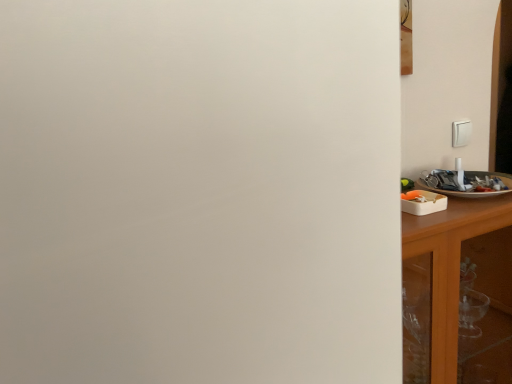
Measure the distance between point (452, 381) and camera.

They are 1.08 meters apart.

Measure the distance between wooden cabinet at right and camera.

The depth of wooden cabinet at right is 36.33 inches.

Describe the element at coordinates (450, 265) in the screenshot. This screenshot has height=384, width=512. I see `wooden cabinet at right` at that location.

At what (x,y) coordinates should I click in order to perform the action: click on wooden cabinet at right. Please return your answer as a coordinate pair (x, y). Looking at the image, I should click on (450, 265).

Locate an element on the screen. The height and width of the screenshot is (384, 512). white glossy plate at right is located at coordinates (469, 191).

This screenshot has height=384, width=512. What do you see at coordinates (469, 191) in the screenshot? I see `white glossy plate at right` at bounding box center [469, 191].

Image resolution: width=512 pixels, height=384 pixels. In order to click on wooden cabinet at right in this screenshot , I will do `click(450, 265)`.

Considering the positions of objects white glossy plate at right and wooden cabinet at right in the image provided, who is more to the right, white glossy plate at right or wooden cabinet at right?

white glossy plate at right is more to the right.

Is white glossy plate at right positioned before wooden cabinet at right?

No.

Which point is more forward, (474, 194) or (454, 350)?

The point (454, 350) is closer to the camera.

From the image's perspective, between white glossy plate at right and wooden cabinet at right, which one is located above?

white glossy plate at right is shown above in the image.

From a real-world perspective, which is physically below, white glossy plate at right or wooden cabinet at right?

In real-world perspective, wooden cabinet at right is lower.

From the picture: Does white glossy plate at right have a lesser width compared to wooden cabinet at right?

Correct, the width of white glossy plate at right is less than that of wooden cabinet at right.

Does white glossy plate at right have a greater height compared to wooden cabinet at right?

No.

Does white glossy plate at right have a larger size compared to wooden cabinet at right?

No, white glossy plate at right is not bigger than wooden cabinet at right.

Is white glossy plate at right completely or partially outside of wooden cabinet at right?

Yes, white glossy plate at right is outside of wooden cabinet at right.

Does white glossy plate at right touch wooden cabinet at right?

white glossy plate at right and wooden cabinet at right are not in contact.

Could you tell me if white glossy plate at right is turned towards wooden cabinet at right?

No, white glossy plate at right is not turned towards wooden cabinet at right.

How different are the orientations of white glossy plate at right and wooden cabinet at right in degrees?

The angle between the facing direction of white glossy plate at right and the facing direction of wooden cabinet at right is 0.000323 degrees.

How much distance is there between white glossy plate at right and wooden cabinet at right?

white glossy plate at right and wooden cabinet at right are 7.18 inches apart from each other.

Where is `cabinetry that is under the white glossy plate at right (from a real-world perspective)`? cabinetry that is under the white glossy plate at right (from a real-world perspective) is located at coordinates [x=450, y=265].

Between wooden cabinet at right and white glossy plate at right, which one appears on the right side from the viewer's perspective?

From the viewer's perspective, white glossy plate at right appears more on the right side.

Considering the positions of objects wooden cabinet at right and white glossy plate at right in the image provided, who is in front, wooden cabinet at right or white glossy plate at right?

Positioned in front is wooden cabinet at right.

Which is behind, point (439, 219) or point (506, 176)?

The point (506, 176) is behind.

From the image's perspective, is wooden cabinet at right positioned above or below white glossy plate at right?

Clearly, from the image's perspective, wooden cabinet at right is below white glossy plate at right.

From a real-world perspective, who is located lower, wooden cabinet at right or white glossy plate at right?

wooden cabinet at right is physically lower.

Which object is wider, wooden cabinet at right or white glossy plate at right?

With larger width is wooden cabinet at right.

Which of these two, wooden cabinet at right or white glossy plate at right, stands shorter?

white glossy plate at right.

Which of these two, wooden cabinet at right or white glossy plate at right, is smaller?

With smaller size is white glossy plate at right.

Is wooden cabinet at right spatially inside white glossy plate at right, or outside of it?

wooden cabinet at right is spatially situated outside white glossy plate at right.

Is wooden cabinet at right placed right next to white glossy plate at right?

No, wooden cabinet at right is not in contact with white glossy plate at right.

Is wooden cabinet at right aimed at white glossy plate at right?

No, wooden cabinet at right is not facing towards white glossy plate at right.

Can you tell me how much wooden cabinet at right and white glossy plate at right differ in facing direction?

The facing directions of wooden cabinet at right and white glossy plate at right are 0.000323 degrees apart.

Where is `cabinetry below the white glossy plate at right (from a real-world perspective)`? cabinetry below the white glossy plate at right (from a real-world perspective) is located at coordinates (450, 265).

Find the location of a particular element. This screenshot has width=512, height=384. tableware on the right of the wooden cabinet at right is located at coordinates (469, 191).

The height and width of the screenshot is (384, 512). In order to click on cabinetry that is under the white glossy plate at right (from a real-world perspective) in this screenshot , I will do `click(450, 265)`.